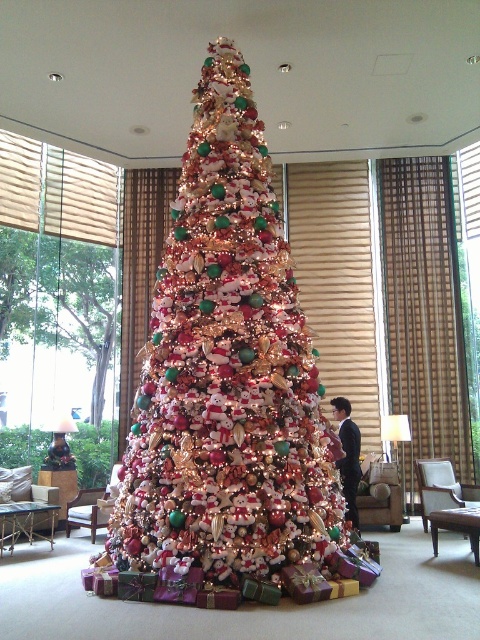
You are a guest at the hotel and want to take a photo of the shiny metallic christmas tree at center. The hotel requires guests to stay at least 1 meter away from the tree to prevent damage. If you are standing at point (x=227, y=374), can you take the photo without violating the rule?

The point (x=227, y=374) is where the shiny metallic christmas tree at center is located, so standing there would mean you are right at the tree. To comply with the hotel rule, you need to move back to a position at least 1 meter away from the tree.

You are a photographer planning to take a photo of the green matte christmas tree at left and the smooth black suit at center. Which object should you focus on first if you want to capture both in a single frame without moving the camera?

The green matte christmas tree at left is larger in size than the smooth black suit at center, so you should focus on the green matte christmas tree at left first to ensure it fills the frame appropriately before adjusting for the smaller smooth black suit at center.

You are a guest at the hotel and want to take a photo of both the shiny metallic christmas tree at center and the smooth black suit at center. Since you can only focus on one object at a time, which one should you position closer to the camera to ensure it is in focus while the other remains slightly blurred?

To ensure the shiny metallic christmas tree at center is in focus while the smooth black suit at center is blurred, position the camera closer to the shiny metallic christmas tree at center since it is on the left side of the smooth black suit at center.